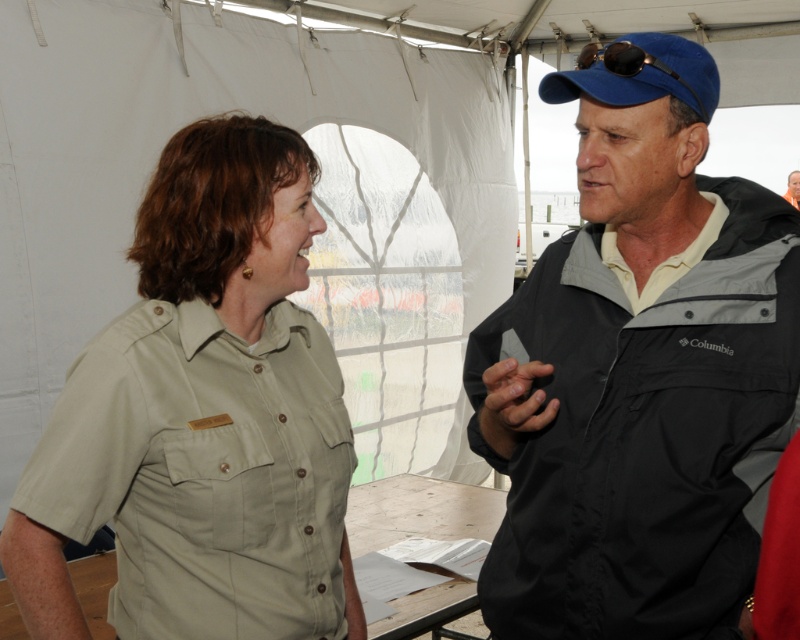
Does black fabric jacket at upper right come in front of satin khaki shirt at center?

Yes, black fabric jacket at upper right is closer to the viewer.

Based on the photo, between black fabric jacket at upper right and satin khaki shirt at center, which one is positioned higher?

black fabric jacket at upper right is higher up.

You are a GUI agent. You are given a task and a screenshot of the screen. Output one action in this format:
    pyautogui.click(x=<x>, y=<y>)
    Task: Click on the black fabric jacket at upper right
    Image resolution: width=800 pixels, height=640 pixels.
    Given the screenshot: What is the action you would take?
    pyautogui.click(x=640, y=371)

Is satin khaki shirt at center in front of matte black jacket at upper right?

That is True.

Image resolution: width=800 pixels, height=640 pixels. I want to click on satin khaki shirt at center, so click(x=202, y=417).

Is black fabric jacket at upper right to the right of matte black jacket at upper right from the viewer's perspective?

In fact, black fabric jacket at upper right is to the left of matte black jacket at upper right.

Does point (736, 516) come in front of point (788, 189)?

That is True.

I want to click on black fabric jacket at upper right, so click(640, 371).